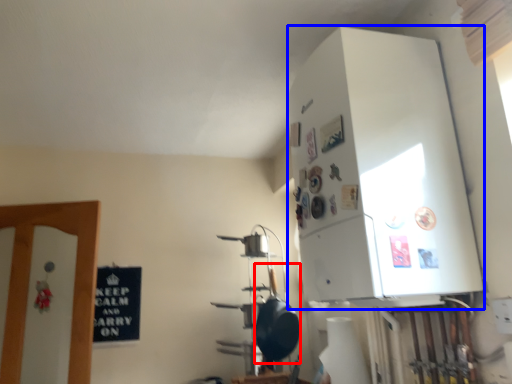
Question: Among these objects, which one is nearest to the camera, wok (highlighted by a red box) or appliance (highlighted by a blue box)?

Choices:
 (A) wok
 (B) appliance

Answer: (B)